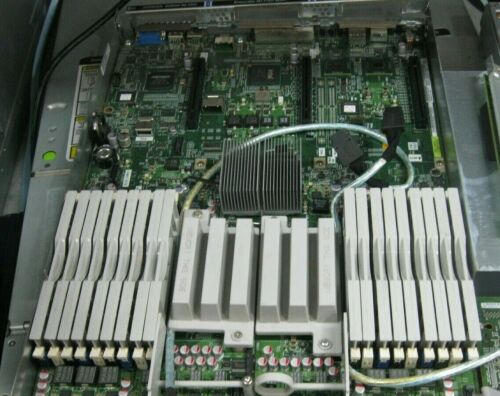
Where is `black wire`? black wire is located at coordinates (87, 33).